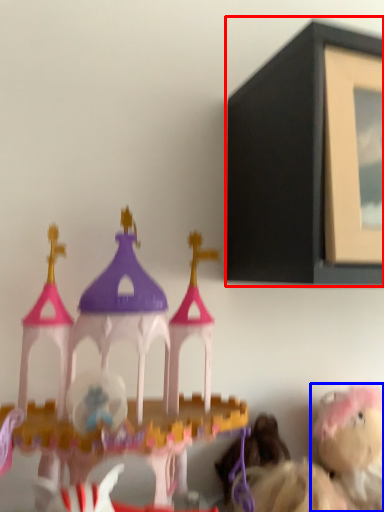
Question: Among these objects, which one is nearest to the camera, picture frame (highlighted by a red box) or toy (highlighted by a blue box)?

Choices:
 (A) picture frame
 (B) toy

Answer: (A)